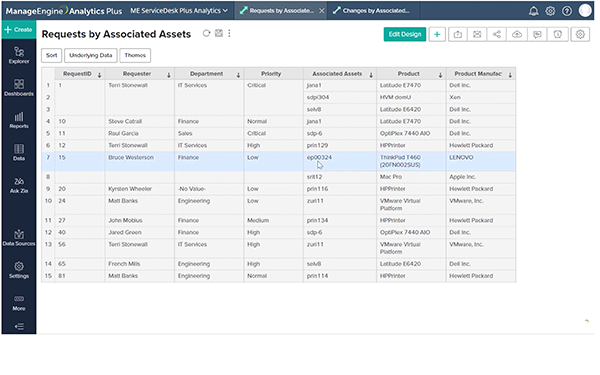
At what (x,y) coordinates should I click in order to perform the action: click on columns. Please return your answer as a coordinate pair (x, y). The height and width of the screenshot is (375, 600). Looking at the image, I should click on (46, 71), (69, 71), (126, 72), (195, 72), (263, 72), (328, 74), (401, 75), (458, 75).